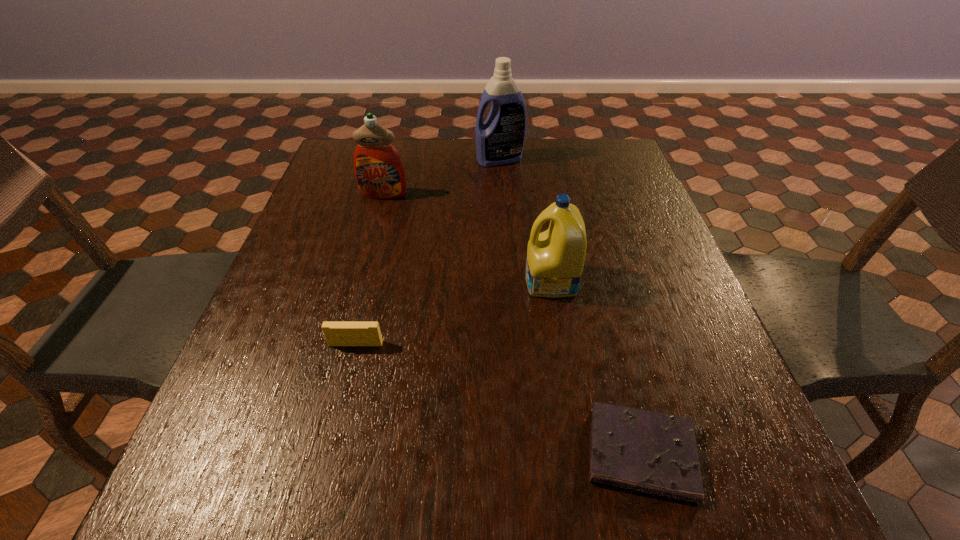
This screenshot has width=960, height=540. What are the coordinates of `unoccupied position between the third farthest object and the diary` in the screenshot? It's located at (596, 367).

I want to click on vacant space that is in between the farthest object and the nearest object, so click(570, 306).

You are a GUI agent. You are given a task and a screenshot of the screen. Output one action in this format:
    pyautogui.click(x=<x>, y=<y>)
    Task: Click on the free space between the nearest object and the farthest object
    Image resolution: width=960 pixels, height=540 pixels.
    Given the screenshot: What is the action you would take?
    pyautogui.click(x=570, y=306)

This screenshot has height=540, width=960. I want to click on free spot between the videotape and the tallest object, so click(x=428, y=252).

This screenshot has height=540, width=960. I want to click on free space between the diary and the farthest object, so click(570, 306).

Identify the location of vacant space that's between the second nearest detergent and the nearest detergent. The width and height of the screenshot is (960, 540). (468, 238).

Identify the location of free space between the nearest object and the nearest detergent. The image size is (960, 540). (596, 367).

Where is `vacant area that lies between the nearest detergent and the tallest detergent`? The image size is (960, 540). vacant area that lies between the nearest detergent and the tallest detergent is located at coordinates (525, 220).

The width and height of the screenshot is (960, 540). Find the location of `object that is the closest to the diary`. object that is the closest to the diary is located at coordinates (555, 258).

At what (x,y) coordinates should I click in order to perform the action: click on object that ranks as the second closest to the tallest detergent. Please return your answer as a coordinate pair (x, y). This screenshot has width=960, height=540. Looking at the image, I should click on (555, 258).